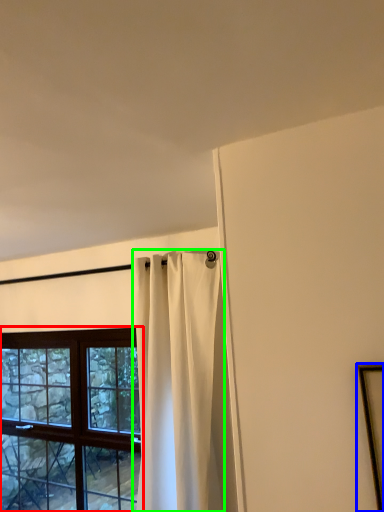
Question: Which is nearer to the window (highlighted by a red box)? picture frame (highlighted by a blue box) or curtain (highlighted by a green box).

Choices:
 (A) picture frame
 (B) curtain

Answer: (B)